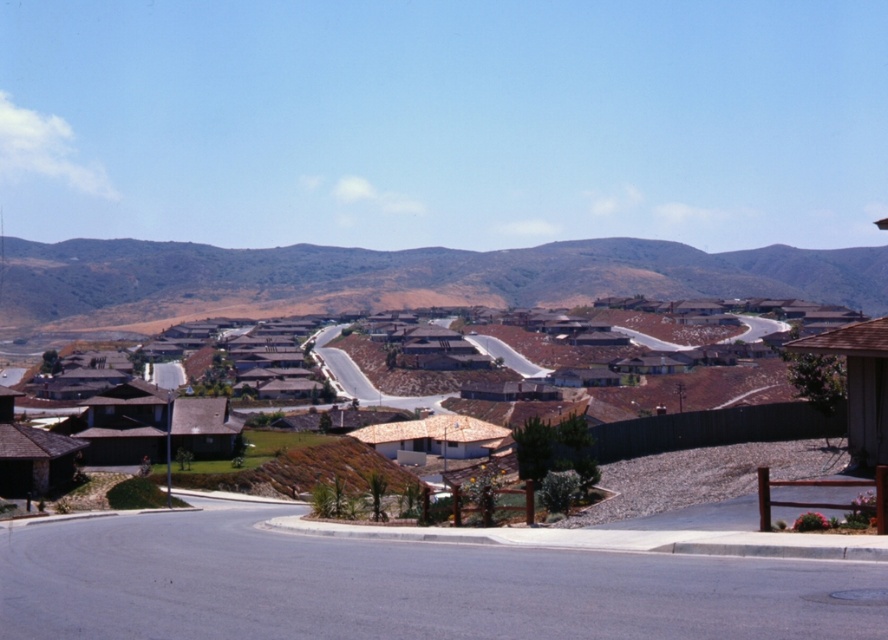
Question: Which object appears farthest from the camera in this image?

Choices:
 (A) brown/dry grassy hillside at upper center
 (B) brown tile roof houses at center

Answer: (A)

Question: Which point is farther to the camera?

Choices:
 (A) (691, 432)
 (B) (80, 268)

Answer: (B)

Question: Can you confirm if brown/dry grassy hillside at upper center is bigger than brown tile roof houses at center?

Choices:
 (A) yes
 (B) no

Answer: (A)

Question: Where is brown/dry grassy hillside at upper center located in relation to brown tile roof houses at center in the image?

Choices:
 (A) left
 (B) right

Answer: (A)

Question: Which object appears farthest from the camera in this image?

Choices:
 (A) brown/dry grassy hillside at upper center
 (B) brown tile roof houses at center

Answer: (A)

Question: Can you confirm if brown/dry grassy hillside at upper center is bigger than brown tile roof houses at center?

Choices:
 (A) no
 (B) yes

Answer: (B)